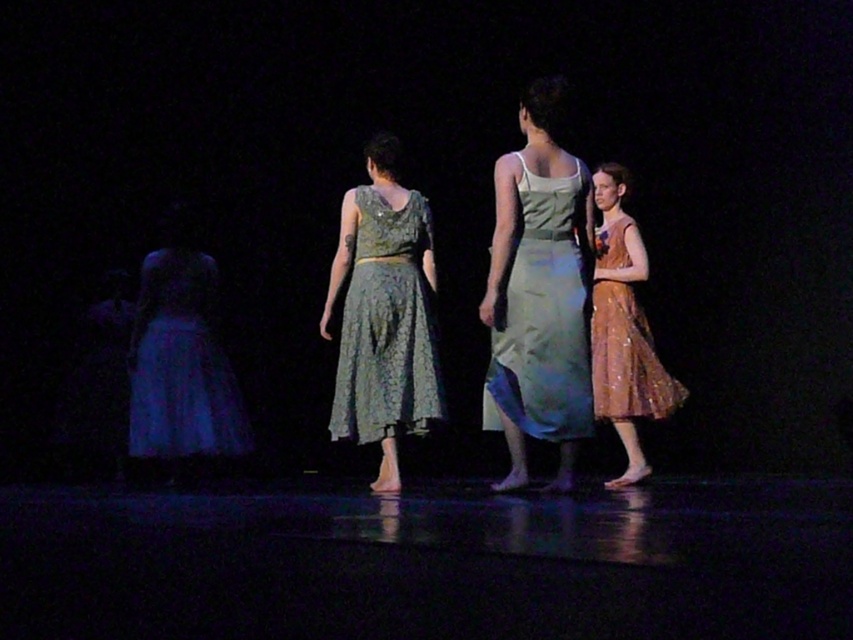
Can you confirm if lace fabric dress at center is thinner than matte blue dress at left?

Yes, lace fabric dress at center is thinner than matte blue dress at left.

In the scene shown: Who is taller, lace fabric dress at center or matte blue dress at left?

matte blue dress at left is taller.

Which is behind, point (415, 387) or point (144, 374)?

The point (144, 374) is more distant.

Where is `lace fabric dress at center`? This screenshot has height=640, width=853. lace fabric dress at center is located at coordinates (386, 324).

Between matte blue dress at left and shiny brown dress at right, which one appears on the right side from the viewer's perspective?

From the viewer's perspective, shiny brown dress at right appears more on the right side.

Does matte blue dress at left have a greater width compared to shiny brown dress at right?

Yes, matte blue dress at left is wider than shiny brown dress at right.

Between point (137, 451) and point (624, 282), which one is positioned in front?

Point (137, 451)

I want to click on matte blue dress at left, so click(x=181, y=356).

Which is more to the left, light green satin dress at center or lace fabric dress at center?

Positioned to the left is lace fabric dress at center.

Which of these two, light green satin dress at center or lace fabric dress at center, stands shorter?

With less height is lace fabric dress at center.

Which is in front, point (532, 211) or point (355, 404)?

Point (532, 211)

Image resolution: width=853 pixels, height=640 pixels. I want to click on light green satin dress at center, so click(x=543, y=316).